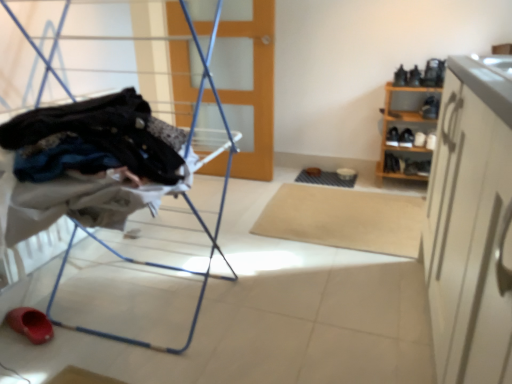
Find the location of a particular element. free space in front of wooden at center is located at coordinates (251, 190).